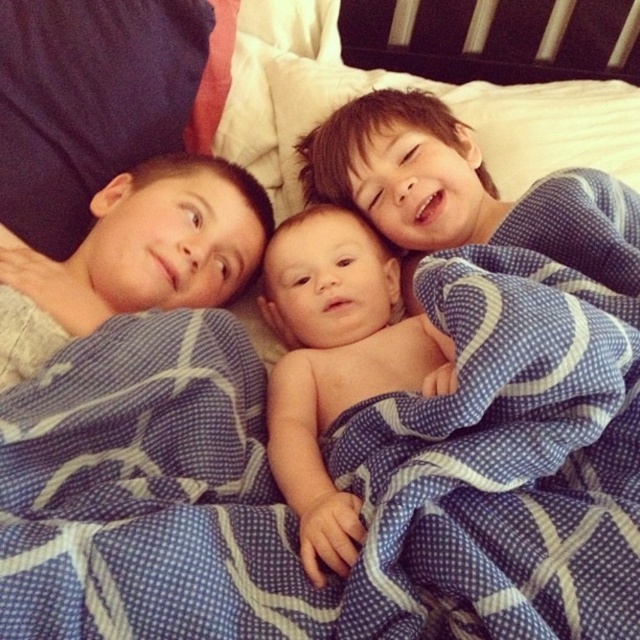
Who is shorter, naked baby at center or smooth skin baby at center?

smooth skin baby at center is shorter.

Who is more forward, (x=307, y=344) or (x=131, y=284)?

Positioned in front is point (x=131, y=284).

This screenshot has width=640, height=640. I want to click on naked baby at center, so click(x=336, y=364).